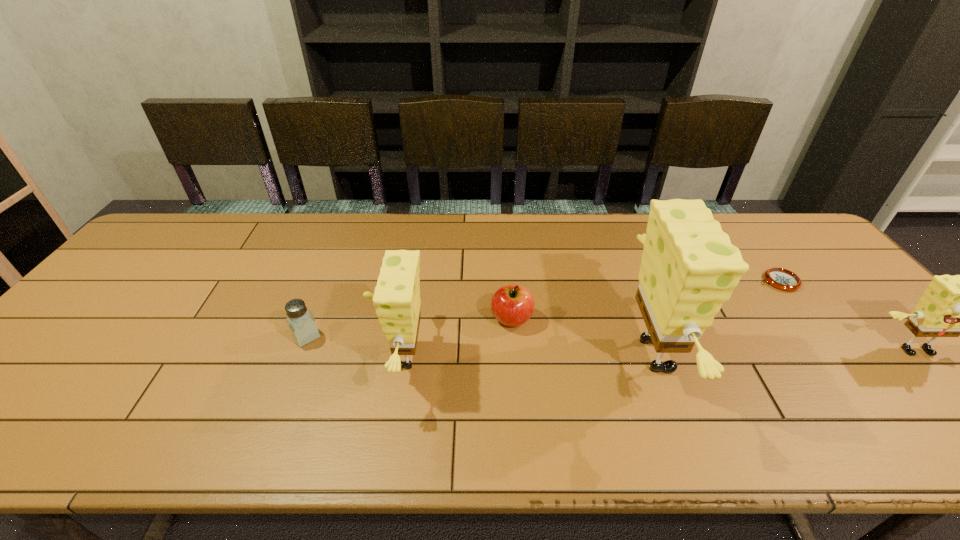
In order to click on the fifth object from right to left in this screenshot , I will do `click(397, 301)`.

Find the location of a particular element. The width and height of the screenshot is (960, 540). the second tallest sponge is located at coordinates (397, 301).

This screenshot has height=540, width=960. I want to click on the third object from right to left, so tap(689, 268).

Locate an element on the screen. The image size is (960, 540). the tallest sponge is located at coordinates (689, 268).

You are a GUI agent. You are given a task and a screenshot of the screen. Output one action in this format:
    pyautogui.click(x=<x>, y=<y>)
    Task: Click on the shortest object
    Image resolution: width=960 pixels, height=540 pixels.
    Given the screenshot: What is the action you would take?
    pyautogui.click(x=783, y=279)

Image resolution: width=960 pixels, height=540 pixels. I want to click on compass, so click(783, 279).

This screenshot has width=960, height=540. In order to click on apple in this screenshot , I will do `click(512, 305)`.

Identify the location of the leftmost object. click(x=300, y=321).

Image resolution: width=960 pixels, height=540 pixels. What are the coordinates of `free space located on the front-facing side of the second tallest object` in the screenshot? It's located at (331, 356).

This screenshot has width=960, height=540. What are the coordinates of `vacant area situated on the front-facing side of the second tallest object` in the screenshot? It's located at (245, 356).